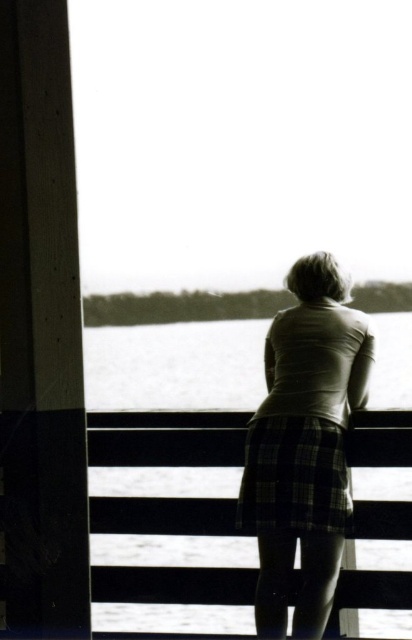
You are a photographer trying to capture the plaid skirt at center in the image. The camera is set to focus on the point at coordinates point [304,445]. Will this point be on the plaid skirt at center?

Yes, because the point [304,445] corresponds to the plaid skirt at center according to the description.

You are standing at the point marked as point [348,346] and want to take a photo of the person on the pier. The camera you have can focus up to 5 meters away. Will you be able to capture the person clearly?

The distance between point [348,346] and the camera is 4.68 meters, which is within the camera focus range of 5 meters. Therefore, you can capture the person clearly.